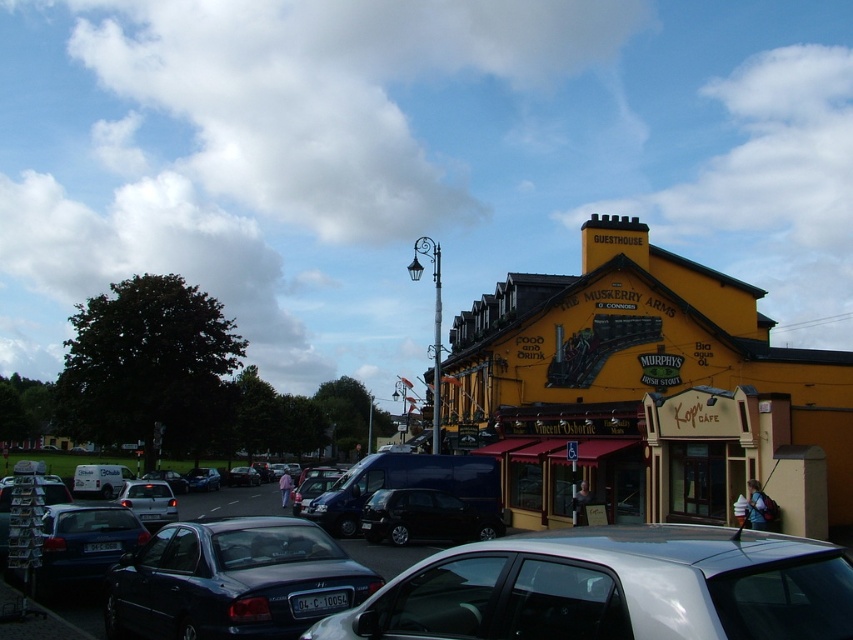
Is point (415, 509) behind point (372, 552)?

That is True.

I want to click on shiny black van at center, so pyautogui.click(x=424, y=516).

Where is `shiny black van at center`? The image size is (853, 640). shiny black van at center is located at coordinates (424, 516).

From the picture: Is shiny black van at center above shiny black sedan at center?

Correct, shiny black van at center is located above shiny black sedan at center.

Locate an element on the screen. This screenshot has width=853, height=640. shiny black van at center is located at coordinates (424, 516).

Is point (343, 561) farther from viewer compared to point (74, 508)?

No, (343, 561) is closer to viewer.

Is shiny dark blue sedan at center positioned behind metallic blue sedan at lower left?

No, shiny dark blue sedan at center is in front of metallic blue sedan at lower left.

Is point (241, 536) more distant than point (80, 540)?

No, (241, 536) is closer to viewer.

Find the location of `shiny dark blue sedan at center`. shiny dark blue sedan at center is located at coordinates (231, 580).